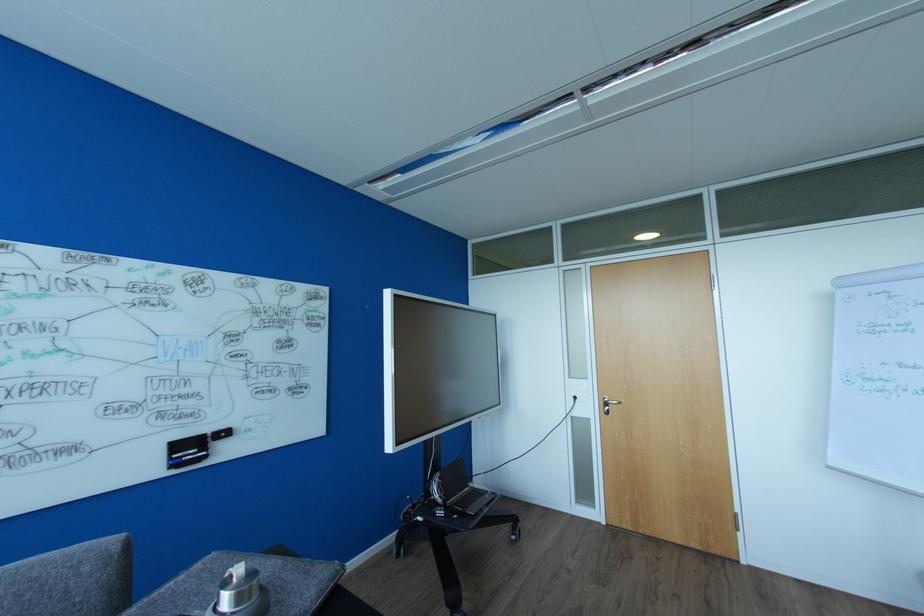
You are a GUI agent. You are given a task and a screenshot of the screen. Output one action in this format:
    pyautogui.click(x=<x>, y=<y>)
    Task: Click on the silver door handle
    
    Given the screenshot: What is the action you would take?
    pos(608,405)